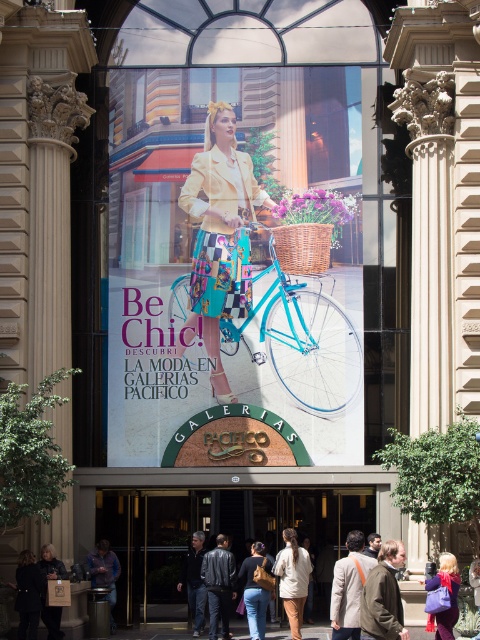
Question: Can you confirm if purple fabric bag at lower right is bigger than black leather jacket at lower left?

Choices:
 (A) no
 (B) yes

Answer: (B)

Question: Which object is positioned farthest from the matte yellow blazer at center?

Choices:
 (A) brown leather jacket at lower center
 (B) teal metallic bicycle at center
 (C) black leather jacket at lower left
 (D) dark brown leather jacket at lower left

Answer: (A)

Question: Can you confirm if leather jacket at center is smaller than dark brown leather coat at lower left?

Choices:
 (A) yes
 (B) no

Answer: (A)

Question: Which of the following is the farthest from the observer?

Choices:
 (A) (201, 618)
 (B) (446, 628)
 (C) (289, 250)

Answer: (C)

Question: Which point appears closest to the camera in this image?

Choices:
 (A) (27, 612)
 (B) (169, 248)

Answer: (A)

Question: Does woven brown basket at center appear on the right side of black leather jacket at lower left?

Choices:
 (A) yes
 (B) no

Answer: (A)